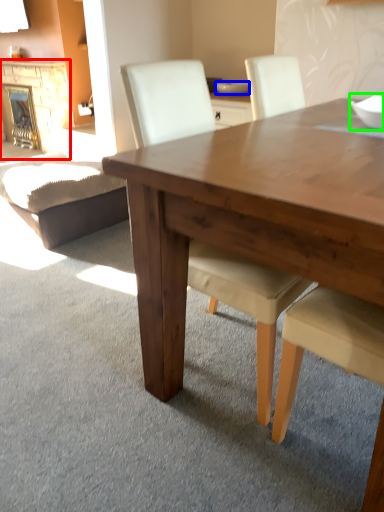
Question: Based on their relative distances, which object is farther from fireplace (highlighted by a red box)? Choose from bowl (highlighted by a blue box) and bowl (highlighted by a green box).

Choices:
 (A) bowl
 (B) bowl

Answer: (B)